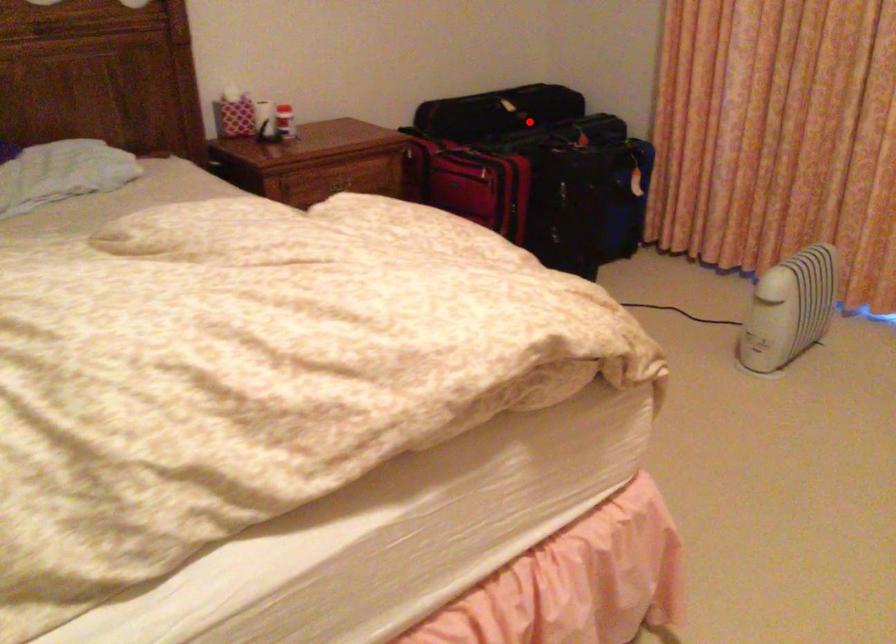
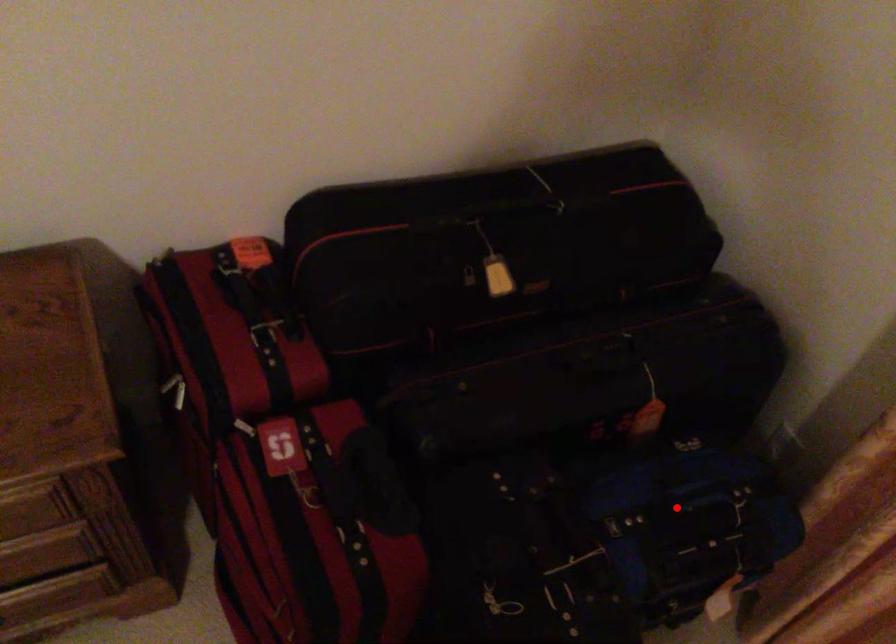
I am providing you with two images of the same scene from different viewpoints. A red point is marked on the first image and another point is marked on the second image. Does the point marked in image1 correspond to the same location as the one in image2?

No